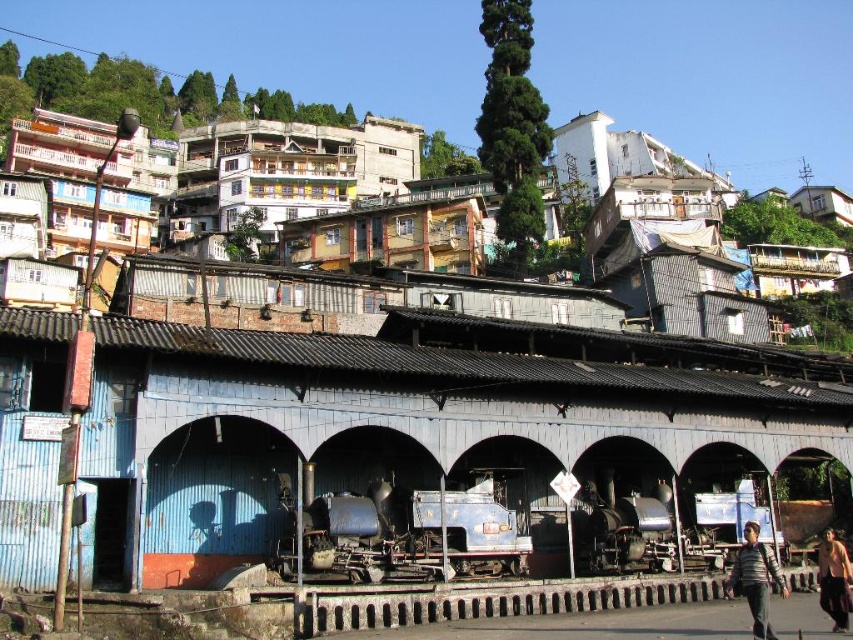
Looking at this image, can you confirm if rustic corrugated metal train station at center is bigger than striped sweater at lower right?

Yes, rustic corrugated metal train station at center is bigger than striped sweater at lower right.

Between point (447, 244) and point (747, 540), which one is positioned behind?

Point (447, 244)

Where is `rustic corrugated metal train station at center`? The height and width of the screenshot is (640, 853). rustic corrugated metal train station at center is located at coordinates (546, 284).

Which is more to the left, striped sweater at lower right or skinny man at lower right?

A: striped sweater at lower right

Is striped sweater at lower right to the right of skinny man at lower right from the viewer's perspective?

No, striped sweater at lower right is not to the right of skinny man at lower right.

This screenshot has width=853, height=640. I want to click on striped sweater at lower right, so click(x=756, y=579).

Where is `striped sweater at lower right`? This screenshot has width=853, height=640. striped sweater at lower right is located at coordinates (756, 579).

Does rustic corrugated metal train station at center appear under skinny man at lower right?

No.

Does rustic corrugated metal train station at center appear over skinny man at lower right?

Yes.

This screenshot has height=640, width=853. What are the coordinates of `rustic corrugated metal train station at center` in the screenshot? It's located at (546, 284).